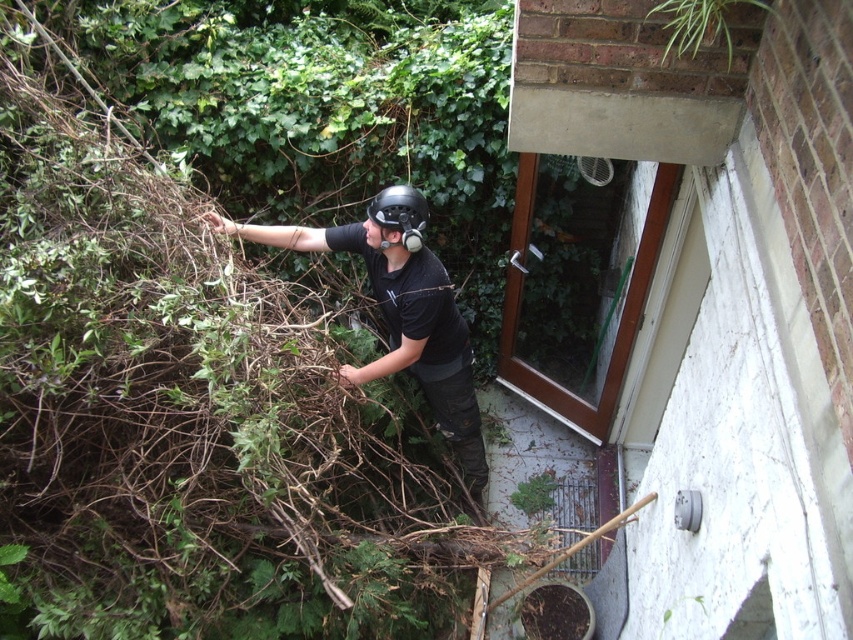
Question: Which object appears closest to the camera in this image?

Choices:
 (A) black matte helmet at upper left
 (B) matte black helmet at center

Answer: (A)

Question: Which object appears farthest from the camera in this image?

Choices:
 (A) black matte helmet at upper left
 (B) matte black helmet at center

Answer: (B)

Question: Is black matte helmet at upper left below matte black helmet at center?

Choices:
 (A) yes
 (B) no

Answer: (A)

Question: Does black matte helmet at upper left appear under matte black helmet at center?

Choices:
 (A) yes
 (B) no

Answer: (A)

Question: Is black matte helmet at upper left to the left of matte black helmet at center from the viewer's perspective?

Choices:
 (A) no
 (B) yes

Answer: (B)